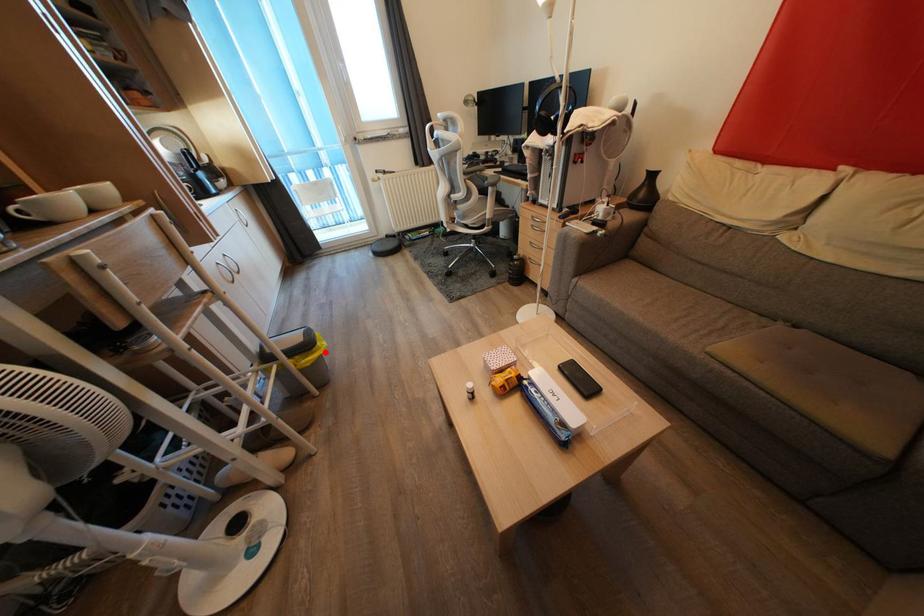
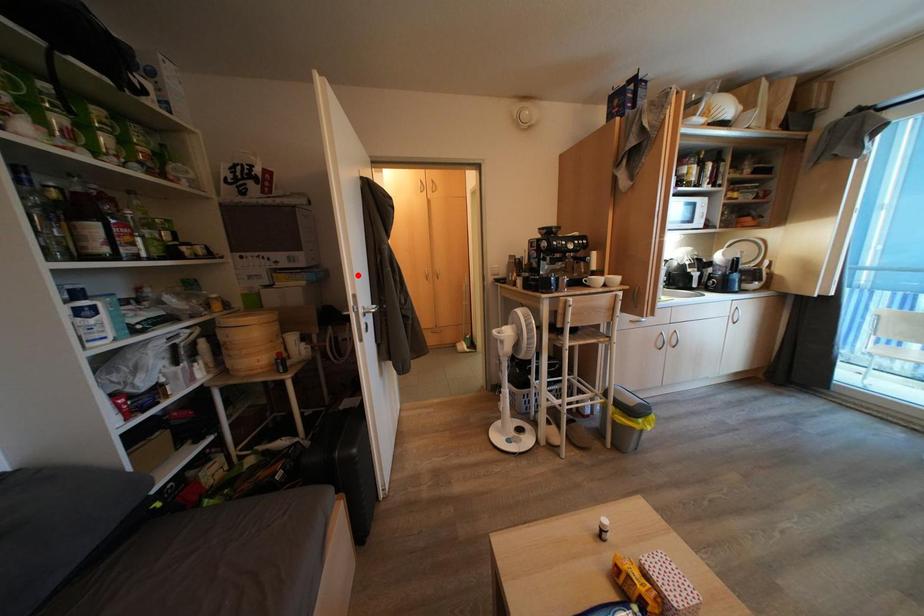
I am providing you with two images of the same scene from different viewpoints. A red point is marked on the first image and another point is marked on the second image. Is the marked point in image1 the same physical position as the marked point in image2?

No